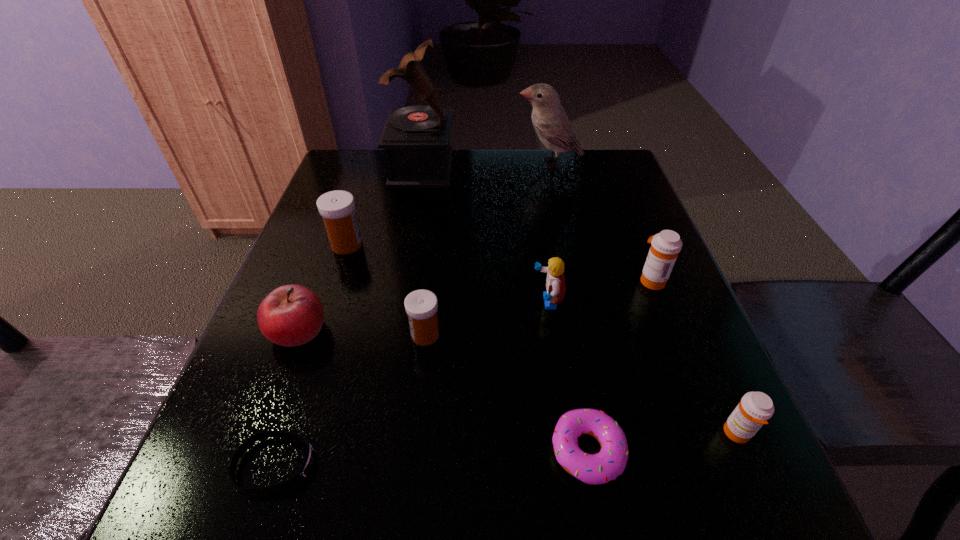
Point out which medicine is positioned as the nearest to the Lego. Please provide its 2D coordinates. Your answer should be formatted as a tuple, i.e. [(x, y)], where the tuple contains the x and y coordinates of a point satisfying the conditions above.

[(665, 246)]

Identify the location of medicine identified as the third closest to the Lego. (755, 408).

You are a GUI agent. You are given a task and a screenshot of the screen. Output one action in this format:
    pyautogui.click(x=<x>, y=<y>)
    Task: Click on the free location that satisfies the following two spatial constraints: 1. at the face of the nearest medicine; 2. on the right side of the ninth shortest object
    
    Given the screenshot: What is the action you would take?
    pyautogui.click(x=609, y=434)

The height and width of the screenshot is (540, 960). I want to click on vacant space that satisfies the following two spatial constraints: 1. on the back side of the farthest medicine; 2. on the right side of the apple, so click(330, 245).

Find the location of a particular element. free spot that satisfies the following two spatial constraints: 1. on the back side of the nearest medicine; 2. at the face of the ninth shortest object is located at coordinates (618, 163).